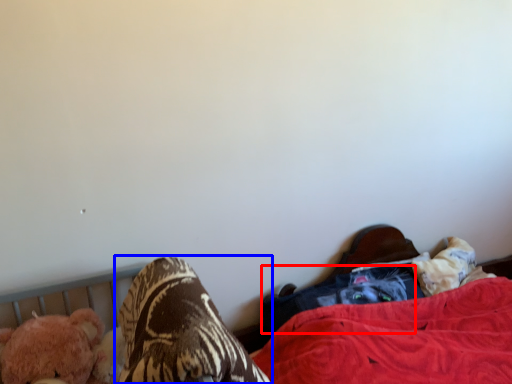
Question: Which object appears closest to the camera in this image, clothing (highlighted by a red box) or footwear (highlighted by a blue box)?

Choices:
 (A) clothing
 (B) footwear

Answer: (B)